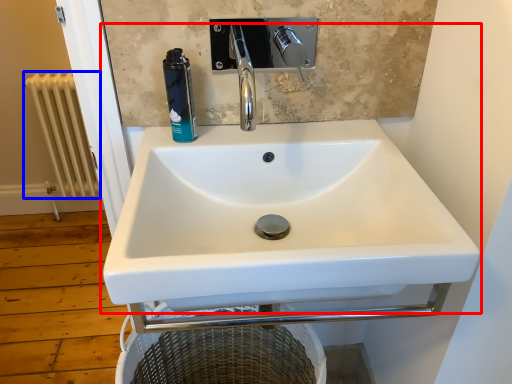
Question: Which object appears closest to the camera in this image, sink (highlighted by a red box) or radiator (highlighted by a blue box)?

Choices:
 (A) sink
 (B) radiator

Answer: (A)